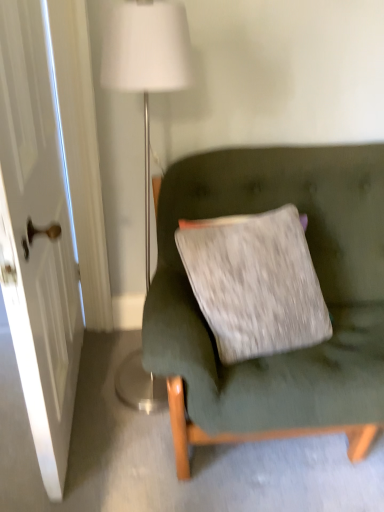
The width and height of the screenshot is (384, 512). What do you see at coordinates (321, 288) in the screenshot? I see `velvet green couch at center` at bounding box center [321, 288].

Measure the distance between point (149, 125) and camera.

Point (149, 125) and camera are 1.55 meters apart.

Locate an element on the screen. white glossy door at left is located at coordinates (38, 236).

Where is `velvet green couch at center`? velvet green couch at center is located at coordinates (321, 288).

Between white fabric lampshade at upper center and velvet green couch at center, which one appears on the left side from the viewer's perspective?

From the viewer's perspective, white fabric lampshade at upper center appears more on the left side.

Could you tell me if white fabric lampshade at upper center is facing velvet green couch at center?

No, white fabric lampshade at upper center is not aimed at velvet green couch at center.

Is white fabric lampshade at upper center positioned behind velvet green couch at center?

That is False.

Where is `lamp above the velvet green couch at center (from the image's perspective)`? The image size is (384, 512). lamp above the velvet green couch at center (from the image's perspective) is located at coordinates (147, 65).

Image resolution: width=384 pixels, height=512 pixels. I want to click on studio couch located on the right of white glossy door at left, so click(x=321, y=288).

Are velvet green couch at center and white glossy door at left far apart?

No, velvet green couch at center is not far away from white glossy door at left.

From a real-world perspective, is velvet green couch at center under white glossy door at left?

Correct, in the physical world, velvet green couch at center is lower than white glossy door at left.

Which of these two, velvet green couch at center or white glossy door at left, is bigger?

white glossy door at left.

Is point (285, 395) closer to camera compared to point (165, 392)?

Yes, it is.

Locate an element on the screen. This screenshot has width=384, height=512. lamp above the velvet green couch at center (from a real-world perspective) is located at coordinates (147, 65).

Considering the sizes of velvet green couch at center and white fabric lampshade at upper center in the image, is velvet green couch at center wider or thinner than white fabric lampshade at upper center?

velvet green couch at center is wider than white fabric lampshade at upper center.

From the image's perspective, which is below, white fabric lampshade at upper center or white glossy door at left?

white glossy door at left is shown below in the image.

Is point (124, 25) closer or farther from the camera than point (69, 210)?

Point (124, 25) appears to be closer to the viewer than point (69, 210).

Consider the image. What's the angular difference between white fabric lampshade at upper center and white glossy door at left's facing directions?

There is a 83.7-degree angle between the facing directions of white fabric lampshade at upper center and white glossy door at left.

From a real-world perspective, is white fabric lampshade at upper center located beneath white glossy door at left?

Yes, from a real-world perspective, white fabric lampshade at upper center is under white glossy door at left.

Is white glossy door at left directly adjacent to white fabric lampshade at upper center?

No, white glossy door at left is not making contact with white fabric lampshade at upper center.

From the image's perspective, does white glossy door at left appear lower than white fabric lampshade at upper center?

Indeed, from the image's perspective, white glossy door at left is shown beneath white fabric lampshade at upper center.

Does white glossy door at left have a larger size compared to white fabric lampshade at upper center?

Yes.

Is white glossy door at left positioned beyond the bounds of white fabric lampshade at upper center?

white glossy door at left is positioned outside white fabric lampshade at upper center.

Is velvet green couch at center a part of white glossy door at left?

No, velvet green couch at center is not surrounded by white glossy door at left.

Which object is closer to the camera, white glossy door at left or velvet green couch at center?

white glossy door at left is in front.

Who is bigger, white glossy door at left or velvet green couch at center?

With larger size is white glossy door at left.

Locate an element on the screen. Image resolution: width=384 pixels, height=512 pixels. lamp in front of the velvet green couch at center is located at coordinates (147, 65).

At what (x,y) coordinates should I click in order to perform the action: click on studio couch below the white glossy door at left (from a real-world perspective). Please return your answer as a coordinate pair (x, y). The image size is (384, 512). Looking at the image, I should click on (321, 288).

Which object lies nearer to the anchor point white glossy door at left, white fabric lampshade at upper center or velvet green couch at center?

white fabric lampshade at upper center is positioned closer to the anchor white glossy door at left.

When comparing their distances from velvet green couch at center, does white fabric lampshade at upper center or white glossy door at left seem further?

white fabric lampshade at upper center.

When comparing their distances from white glossy door at left, does velvet green couch at center or white fabric lampshade at upper center seem closer?

white fabric lampshade at upper center.

Estimate the real-world distances between objects in this image. Which object is closer to white fabric lampshade at upper center, velvet green couch at center or white glossy door at left?

white glossy door at left is closer to white fabric lampshade at upper center.

From the image, which object appears to be nearer to velvet green couch at center, white glossy door at left or white fabric lampshade at upper center?

white glossy door at left.

Based on their spatial positions, is white glossy door at left or velvet green couch at center further from white fabric lampshade at upper center?

Based on the image, velvet green couch at center appears to be further to white fabric lampshade at upper center.

The image size is (384, 512). Identify the location of lamp located between white glossy door at left and velvet green couch at center in the left-right direction. 147,65.